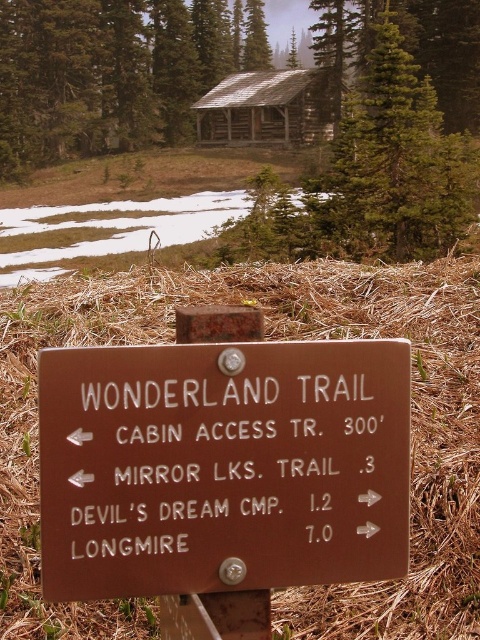
Question: Does brown wooden sign at center have a lesser width compared to green textured log cabin at upper center?

Choices:
 (A) no
 (B) yes

Answer: (B)

Question: Which point is closer to the camera?

Choices:
 (A) (295, 104)
 (B) (91, 596)
 (C) (303, 196)

Answer: (B)

Question: Among these points, which one is nearest to the camera?

Choices:
 (A) (206, 116)
 (B) (384, 148)
 (C) (204, 381)

Answer: (C)

Question: Does green textured log cabin at upper center appear under wooden cabin at upper center?

Choices:
 (A) yes
 (B) no

Answer: (A)

Question: Which object is positioned farthest from the wooden cabin at upper center?

Choices:
 (A) brown wooden sign at center
 (B) green textured log cabin at upper center

Answer: (A)

Question: Is brown wooden sign at center behind green textured log cabin at upper center?

Choices:
 (A) yes
 (B) no

Answer: (B)